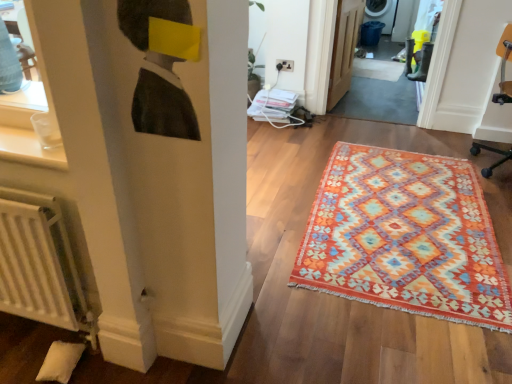
Question: Considering the relative positions of multicolored woven rug at center and white matte radiator at lower left in the image provided, is multicolored woven rug at center to the left or to the right of white matte radiator at lower left?

Choices:
 (A) left
 (B) right

Answer: (B)

Question: From the image's perspective, is multicolored woven rug at center positioned above or below white matte radiator at lower left?

Choices:
 (A) below
 (B) above

Answer: (B)

Question: Estimate the real-world distances between objects in this image. Which object is farther from the multicolored woven rug at center?

Choices:
 (A) orange woven rug at center
 (B) orange fabric swivel chair at right
 (C) white matte radiator at lower left
 (D) wooden door at center

Answer: (A)

Question: Estimate the real-world distances between objects in this image. Which object is closer to the white matte radiator at lower left?

Choices:
 (A) multicolored woven rug at center
 (B) orange fabric swivel chair at right
 (C) wooden door at center
 (D) orange woven rug at center

Answer: (A)